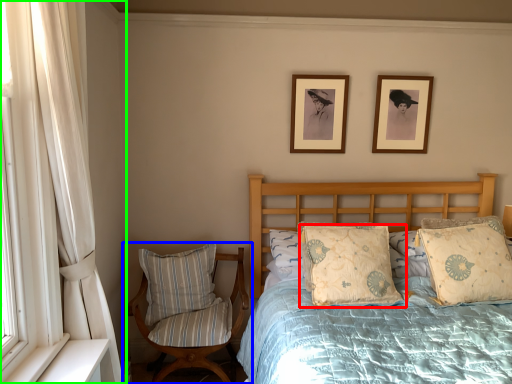
Question: Which is farther away from pillow (highlighted by a red box)? chair (highlighted by a blue box) or curtain (highlighted by a green box)?

Choices:
 (A) chair
 (B) curtain

Answer: (B)